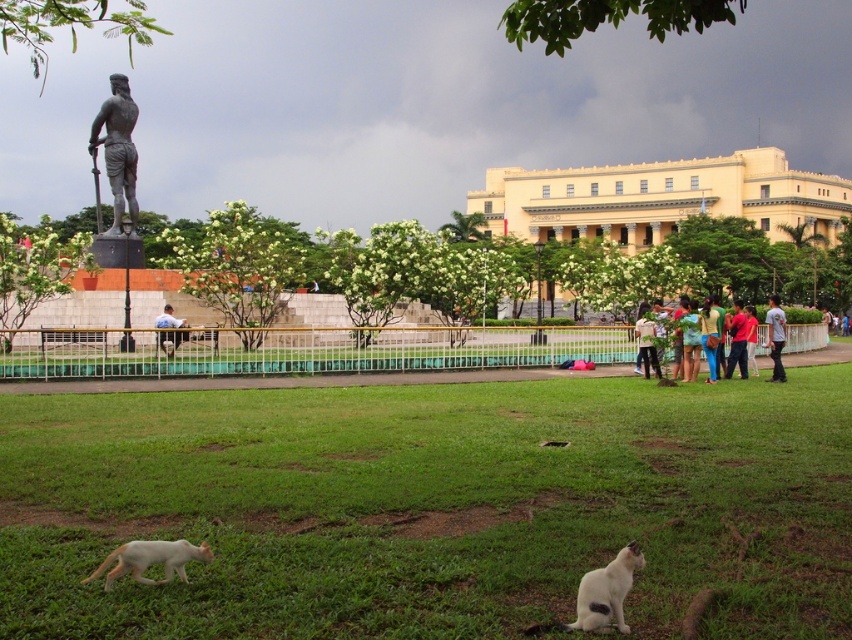
Question: Does white fur cat at lower left have a larger size compared to gray cotton shirt at center?

Choices:
 (A) no
 (B) yes

Answer: (A)

Question: Based on their relative distances, which object is nearer to the light blue shirt at center?

Choices:
 (A) light brown fabric shirt at center
 (B) green fabric shirt at center

Answer: (A)

Question: Which point is closer to the camera?

Choices:
 (A) (158, 342)
 (B) (639, 200)
 (C) (773, 356)

Answer: (A)

Question: Which object is the farthest from the green fabric shirt at center?

Choices:
 (A) yellow stucco building at upper center
 (B) red fabric shirt at center
 (C) white fur cat at lower right

Answer: (A)

Question: Does green fabric shirt at center have a lesser width compared to red fabric shirt at center?

Choices:
 (A) no
 (B) yes

Answer: (A)

Question: Is bronze statue at upper left thinner than green fabric pants at center?

Choices:
 (A) yes
 (B) no

Answer: (B)